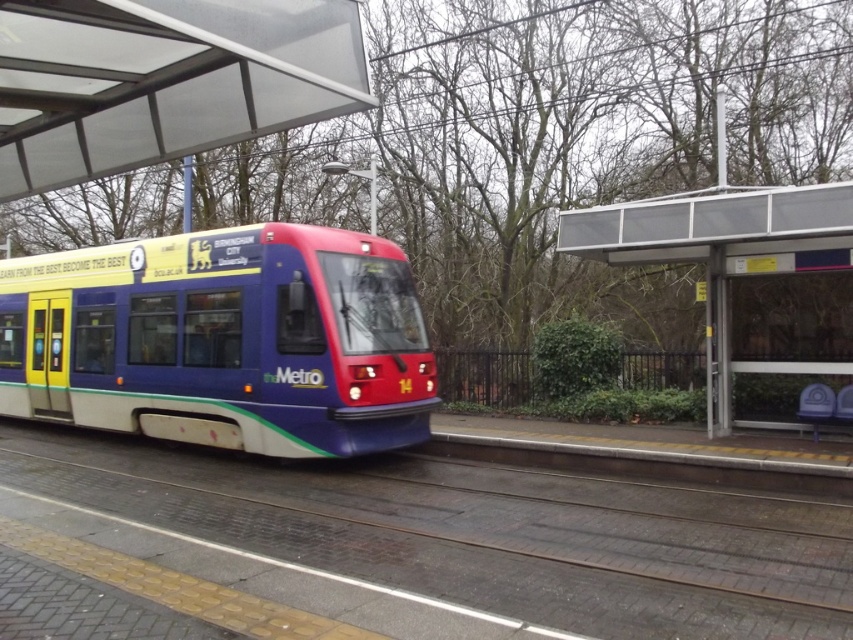
Is metallic track at center to the left of matte blue train at center from the viewer's perspective?

No, metallic track at center is not to the left of matte blue train at center.

Can you confirm if metallic track at center is shorter than matte blue train at center?

Yes.

Measure the distance between point (648, 556) and camera.

Point (648, 556) and camera are 5.77 meters apart.

Where is `metallic track at center`? The width and height of the screenshot is (853, 640). metallic track at center is located at coordinates (401, 548).